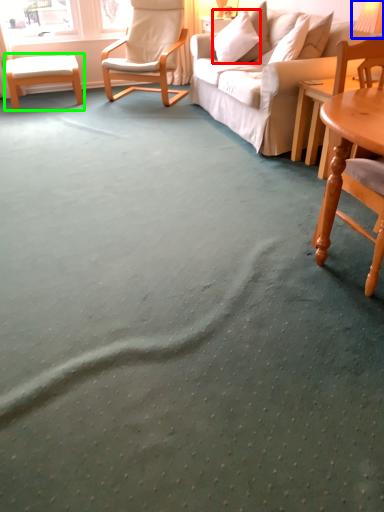
Question: Which is nearer to the pillow (highlighted by a red box)? table lamp (highlighted by a blue box) or table (highlighted by a green box).

Choices:
 (A) table lamp
 (B) table

Answer: (A)